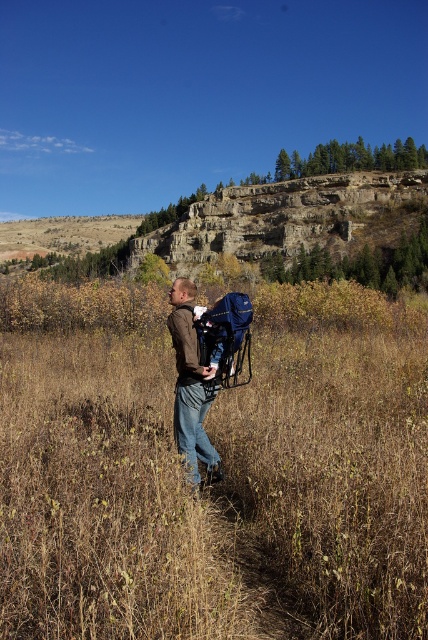
Does brown dry grass at center have a lesser height compared to brown leather jacket at center?

In fact, brown dry grass at center may be taller than brown leather jacket at center.

Is brown dry grass at center to the right of brown leather jacket at center from the viewer's perspective?

Incorrect, brown dry grass at center is not on the right side of brown leather jacket at center.

Is point (392, 353) closer to viewer compared to point (187, 388)?

No, (392, 353) is behind (187, 388).

At what (x,y) coordinates should I click in order to perform the action: click on brown dry grass at center. Please return your answer as a coordinate pair (x, y). Image resolution: width=428 pixels, height=640 pixels. Looking at the image, I should click on (223, 467).